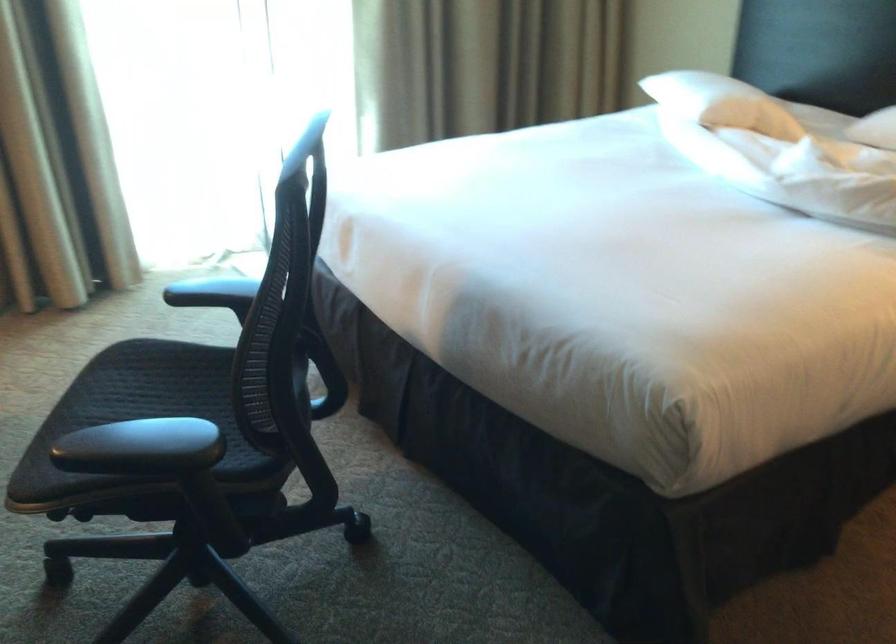
Image resolution: width=896 pixels, height=644 pixels. What do you see at coordinates (159, 379) in the screenshot?
I see `a chair sitting surface` at bounding box center [159, 379].